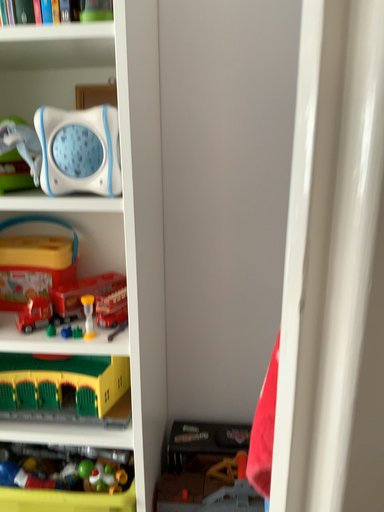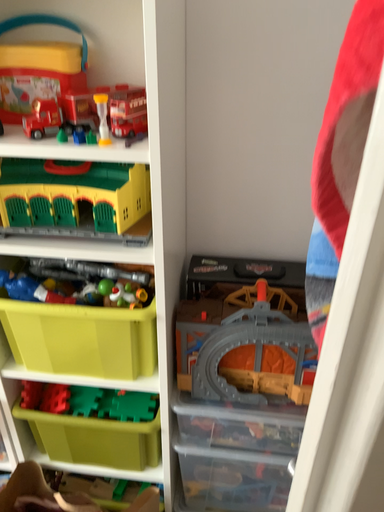
Question: Which way did the camera rotate in the video?

Choices:
 (A) rotated upward
 (B) rotated downward

Answer: (B)